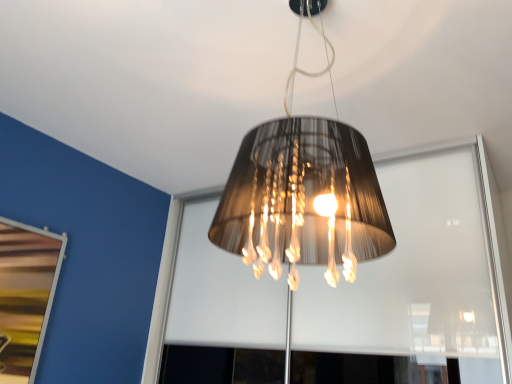
At what (x,y) coordinates should I click in order to perform the action: click on smokey glass chandelier at center. Please return your answer as a coordinate pair (x, y). This screenshot has width=512, height=384. Looking at the image, I should click on (303, 198).

This screenshot has width=512, height=384. Describe the element at coordinates (303, 198) in the screenshot. I see `smokey glass chandelier at center` at that location.

Image resolution: width=512 pixels, height=384 pixels. Identify the location of smokey glass chandelier at center. (303, 198).